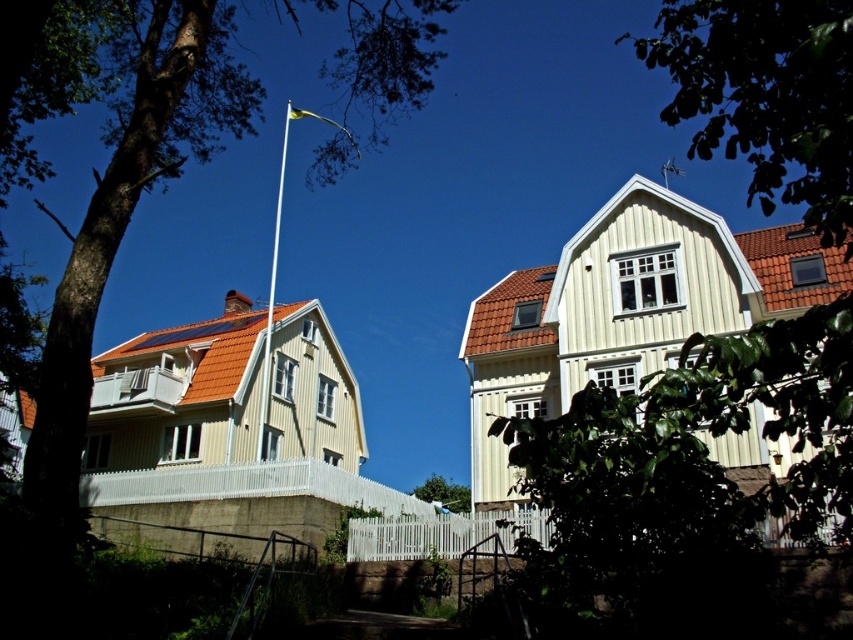
Is metallic flag pole at upper center in front of green leafy tree at center?

Yes, it is in front of green leafy tree at center.

Between metallic flag pole at upper center and green leafy tree at center, which one appears on the right side from the viewer's perspective?

From the viewer's perspective, green leafy tree at center appears more on the right side.

Measure the distance between point [282,182] and camera.

Point [282,182] is 174.56 meters away from camera.

Image resolution: width=853 pixels, height=640 pixels. In order to click on metallic flag pole at upper center in this screenshot , I will do [271, 298].

Can you confirm if brown textured tree at upper left is wider than metallic flag pole at upper center?

Yes, brown textured tree at upper left is wider than metallic flag pole at upper center.

Does brown textured tree at upper left have a lesser width compared to metallic flag pole at upper center?

No.

Between point (148, 83) and point (260, 380), which one is positioned in front?

Point (148, 83) is in front.

Locate an element on the screen. brown textured tree at upper left is located at coordinates (106, 179).

Consider the image. Does metallic flag pole at upper center have a greater height compared to metallic flagpole at upper center?

Yes, metallic flag pole at upper center is taller than metallic flagpole at upper center.

Who is positioned more to the left, metallic flag pole at upper center or metallic flagpole at upper center?

metallic flag pole at upper center

At what (x,y) coordinates should I click in order to perform the action: click on metallic flag pole at upper center. Please return your answer as a coordinate pair (x, y). Looking at the image, I should click on (271, 298).